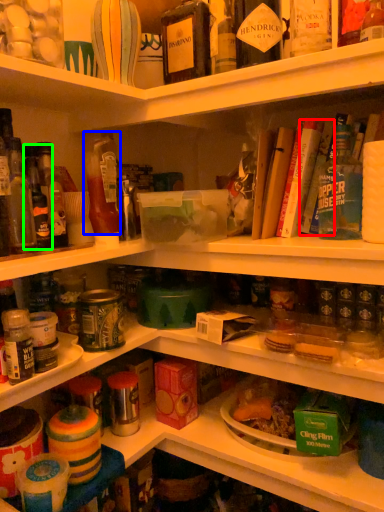
Question: Which is farther away from book (highlighted by a red box)? bottle (highlighted by a blue box) or bottle (highlighted by a green box)?

Choices:
 (A) bottle
 (B) bottle

Answer: (B)